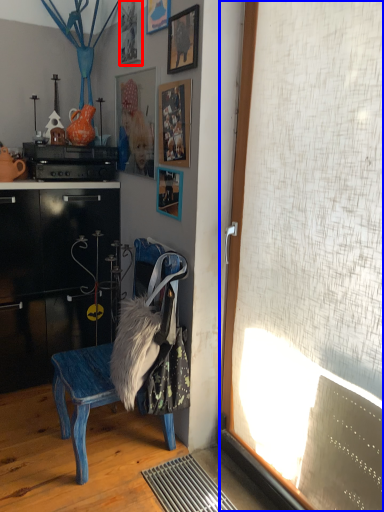
Question: Among these objects, which one is farthest to the camera, picture frame (highlighted by a red box) or window screen (highlighted by a blue box)?

Choices:
 (A) picture frame
 (B) window screen

Answer: (A)